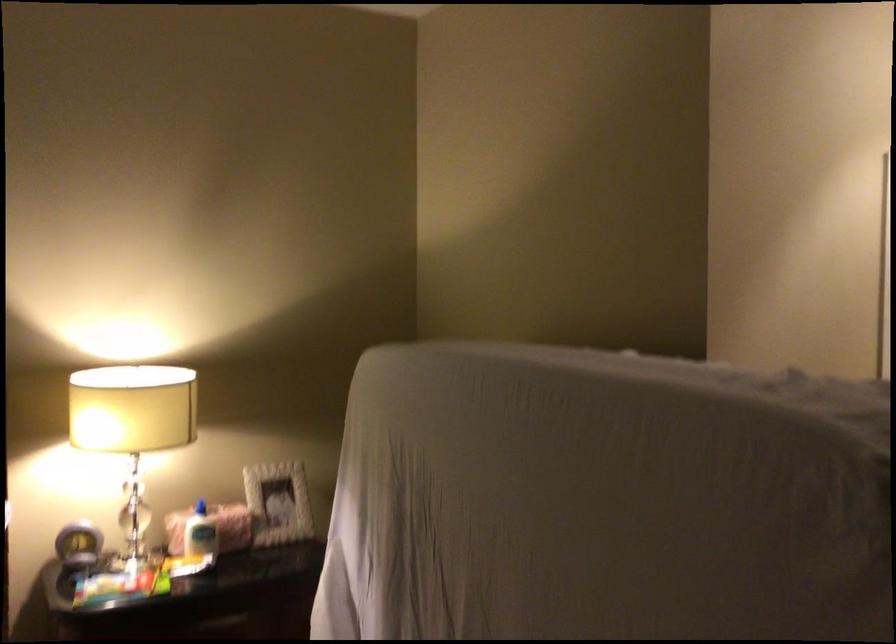
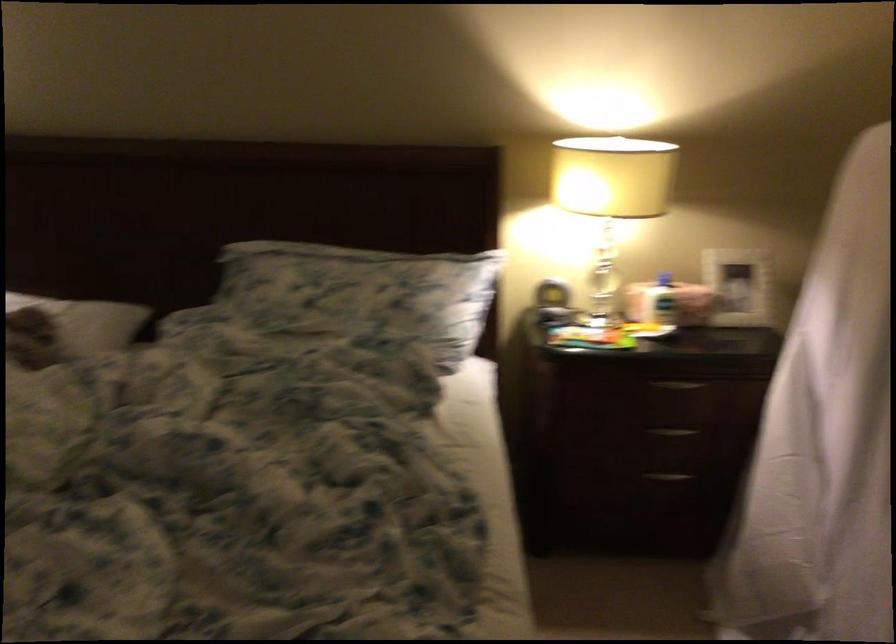
Locate, in the second image, the point that corresponds to (195,513) in the first image.

(664, 279)